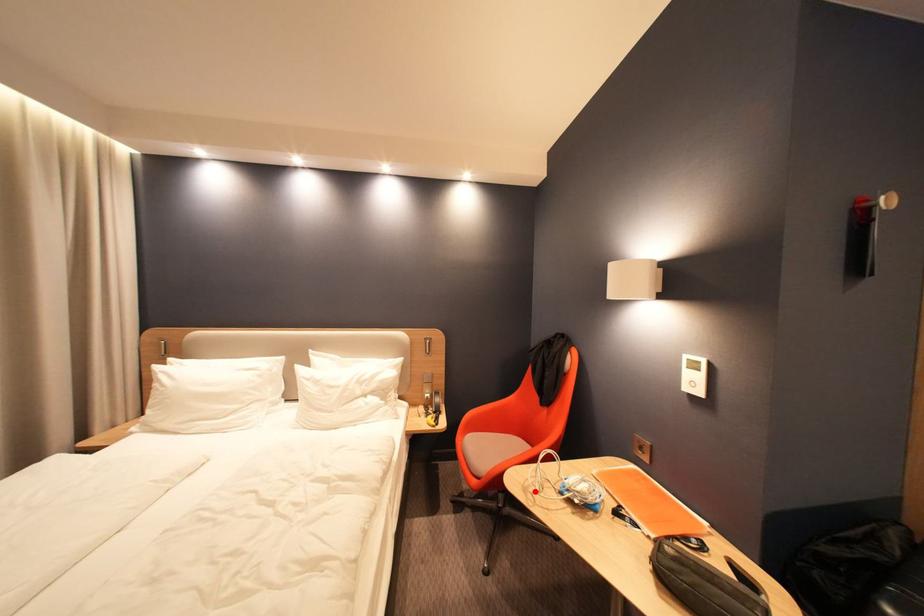
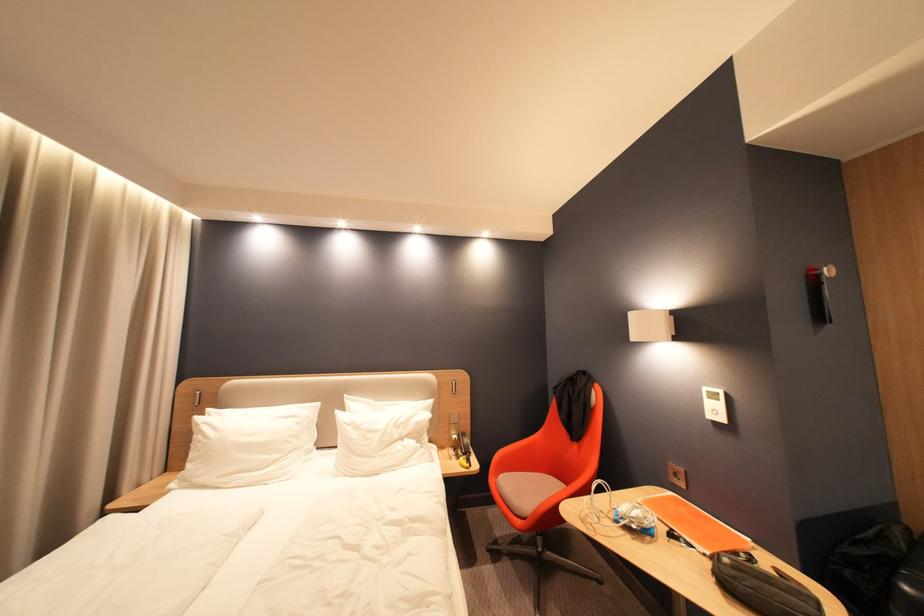
Question: I am providing you with two images of the same scene from different viewpoints. In image1, a red point is highlighted. Considering the same 3D point in image2, which of the following is correct?

Choices:
 (A) It is closer
 (B) It is farther

Answer: (B)